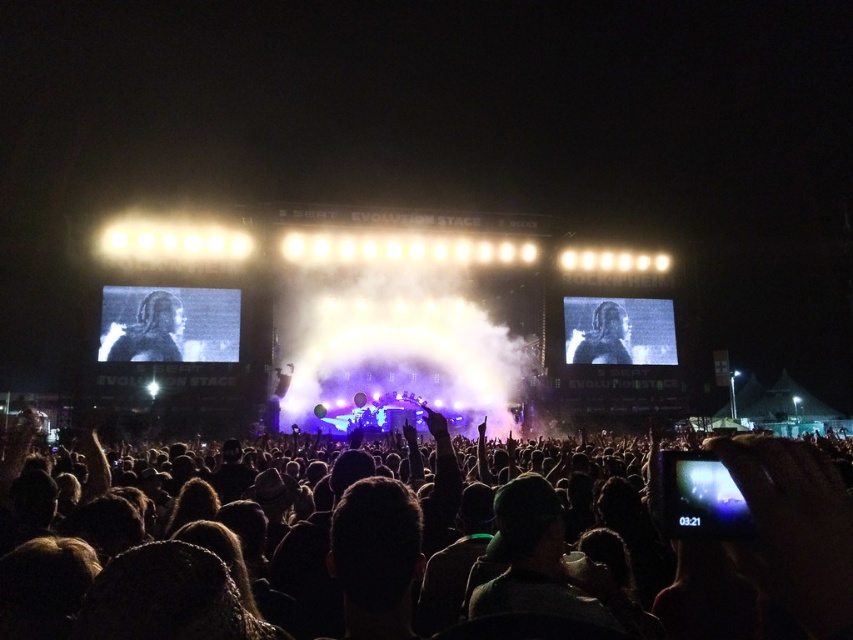
Between gray metallic figure at center and smooth skin face at center, which one appears on the right side from the viewer's perspective?

smooth skin face at center is more to the right.

Does gray metallic figure at center have a smaller size compared to smooth skin face at center?

Indeed, gray metallic figure at center has a smaller size compared to smooth skin face at center.

Identify the location of gray metallic figure at center. The image size is (853, 640). (148, 332).

Where is `gray metallic figure at center`? The width and height of the screenshot is (853, 640). gray metallic figure at center is located at coordinates (148, 332).

Can you confirm if black matte crowd at center is shorter than gray metallic figure at center?

No.

Does black matte crowd at center appear on the left side of gray metallic figure at center?

Incorrect, black matte crowd at center is not on the left side of gray metallic figure at center.

The image size is (853, 640). I want to click on black matte crowd at center, so click(x=793, y=529).

Is black matte crowd at center to the left of smooth skin face at center from the viewer's perspective?

Correct, you'll find black matte crowd at center to the left of smooth skin face at center.

Between black matte crowd at center and smooth skin face at center, which one appears on the left side from the viewer's perspective?

From the viewer's perspective, black matte crowd at center appears more on the left side.

Identify the location of black matte crowd at center. The height and width of the screenshot is (640, 853). (793, 529).

What are the coordinates of `black matte crowd at center` in the screenshot? It's located at click(x=793, y=529).